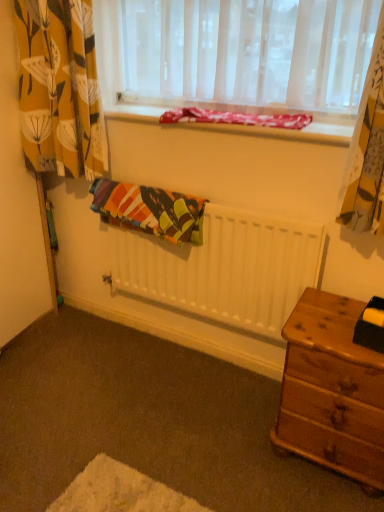
Question: Is multicolored fabric at center next to white matte radiator at center?

Choices:
 (A) yes
 (B) no

Answer: (B)

Question: Can you confirm if multicolored fabric at center is smaller than white matte radiator at center?

Choices:
 (A) yes
 (B) no

Answer: (A)

Question: Can you confirm if multicolored fabric at center is wider than white matte radiator at center?

Choices:
 (A) yes
 (B) no

Answer: (A)

Question: Can you confirm if multicolored fabric at center is positioned to the left of white matte radiator at center?

Choices:
 (A) no
 (B) yes

Answer: (B)

Question: Is white matte radiator at center located within multicolored fabric at center?

Choices:
 (A) yes
 (B) no

Answer: (B)

Question: Looking at their shapes, would you say textured fabric at upper center is wider or thinner than multicolored fabric at center?

Choices:
 (A) thin
 (B) wide

Answer: (B)

Question: From the image's perspective, relative to multicolored fabric at center, is textured fabric at upper center above or below?

Choices:
 (A) above
 (B) below

Answer: (A)

Question: From a real-world perspective, is textured fabric at upper center physically located above or below multicolored fabric at center?

Choices:
 (A) above
 (B) below

Answer: (A)

Question: In terms of size, does textured fabric at upper center appear bigger or smaller than multicolored fabric at center?

Choices:
 (A) small
 (B) big

Answer: (A)

Question: From the image's perspective, is translucent fabric at upper center located above or below textured fabric at upper center?

Choices:
 (A) above
 (B) below

Answer: (A)

Question: In terms of height, does translucent fabric at upper center look taller or shorter compared to textured fabric at upper center?

Choices:
 (A) tall
 (B) short

Answer: (A)

Question: Considering the positions of point (269, 9) and point (279, 133), is point (269, 9) closer or farther from the camera than point (279, 133)?

Choices:
 (A) closer
 (B) farther

Answer: (A)

Question: From a real-world perspective, is translucent fabric at upper center physically located above or below textured fabric at upper center?

Choices:
 (A) above
 (B) below

Answer: (A)

Question: Is yellow floral fabric at left taller or shorter than translucent fabric at upper center?

Choices:
 (A) tall
 (B) short

Answer: (A)

Question: From the image's perspective, is yellow floral fabric at left located above or below translucent fabric at upper center?

Choices:
 (A) above
 (B) below

Answer: (B)